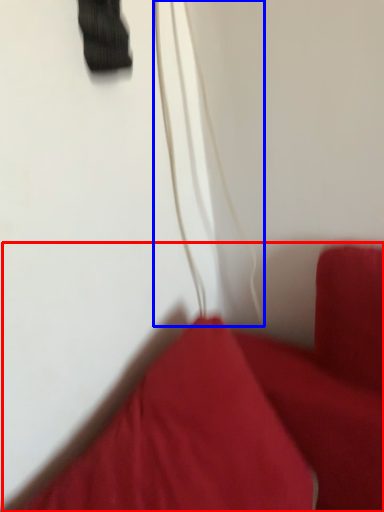
Question: Which of the following is the closest to the observer, furniture (highlighted by a red box) or string (highlighted by a blue box)?

Choices:
 (A) furniture
 (B) string

Answer: (A)